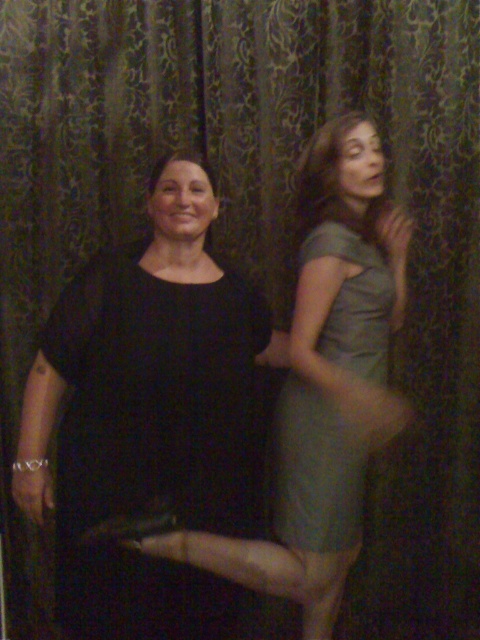
Can you confirm if matte gray dress at center is positioned to the right of satin green dress at right?

Incorrect, matte gray dress at center is not on the right side of satin green dress at right.

Is matte gray dress at center behind satin green dress at right?

No, matte gray dress at center is in front of satin green dress at right.

This screenshot has height=640, width=480. What are the coordinates of `matte gray dress at center` in the screenshot? It's located at (325, 381).

How far apart are black matte dress at center and matte gray dress at center?

black matte dress at center and matte gray dress at center are 9.99 inches apart from each other.

Does black matte dress at center appear under matte gray dress at center?

Indeed, black matte dress at center is positioned under matte gray dress at center.

Does point (232, 499) come behind point (297, 449)?

No.

The image size is (480, 640). In order to click on black matte dress at center in this screenshot , I will do `click(152, 440)`.

Between black matte dress at center and satin green dress at right, which one has less height?

With less height is satin green dress at right.

Is black matte dress at center wider than satin green dress at right?

Correct, the width of black matte dress at center exceeds that of satin green dress at right.

Locate an element on the screen. The height and width of the screenshot is (640, 480). black matte dress at center is located at coordinates pos(152,440).